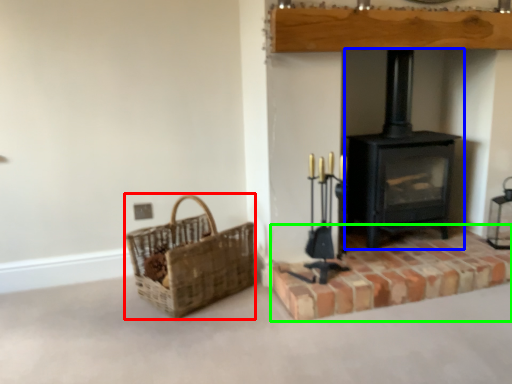
Question: Which is farther away from basket (highlighted by a red box)? wood burning stove (highlighted by a blue box) or brickwork (highlighted by a green box)?

Choices:
 (A) wood burning stove
 (B) brickwork

Answer: (A)